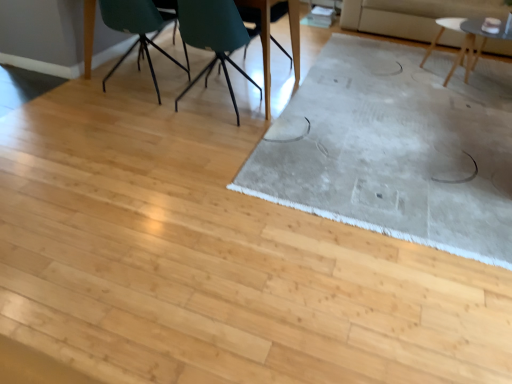
Question: Is teal plastic chair at upper center, which ranks as the 2th chair in left-to-right order, at the right side of matte wood table at upper center, marked as the 2th table in a right-to-left arrangement?

Choices:
 (A) no
 (B) yes

Answer: (B)

Question: From a real-world perspective, is teal plastic chair at upper center, the second chair in the right-to-left sequence, physically above matte wood table at upper center, acting as the first table starting from the left?

Choices:
 (A) no
 (B) yes

Answer: (B)

Question: Is teal plastic chair at upper center, the second chair in the right-to-left sequence, in contact with matte wood table at upper center, acting as the first table starting from the left?

Choices:
 (A) yes
 (B) no

Answer: (B)

Question: Can you confirm if teal plastic chair at upper center, the second chair in the right-to-left sequence, is shorter than matte wood table at upper center, marked as the 2th table in a right-to-left arrangement?

Choices:
 (A) no
 (B) yes

Answer: (B)

Question: Are teal plastic chair at upper center, which ranks as the 2th chair in left-to-right order, and matte wood table at upper center, marked as the 2th table in a right-to-left arrangement, located far from each other?

Choices:
 (A) no
 (B) yes

Answer: (A)

Question: From a real-world perspective, is matte wood table at upper center, acting as the first table starting from the left, physically located above or below beige fabric couch at upper right?

Choices:
 (A) below
 (B) above

Answer: (B)

Question: Would you say matte wood table at upper center, acting as the first table starting from the left, is to the left or to the right of beige fabric couch at upper right in the picture?

Choices:
 (A) left
 (B) right

Answer: (A)

Question: From the image's perspective, is matte wood table at upper center, acting as the first table starting from the left, positioned above or below beige fabric couch at upper right?

Choices:
 (A) above
 (B) below

Answer: (B)

Question: Would you say matte wood table at upper center, acting as the first table starting from the left, is inside or outside beige fabric couch at upper right?

Choices:
 (A) outside
 (B) inside

Answer: (A)

Question: Considering the relative positions of matte teal chair at upper left, positioned as the 3th chair in right-to-left order, and matte wood table at upper center, acting as the first table starting from the left, in the image provided, is matte teal chair at upper left, positioned as the 3th chair in right-to-left order, to the left or to the right of matte wood table at upper center, acting as the first table starting from the left,?

Choices:
 (A) right
 (B) left

Answer: (B)

Question: From the image's perspective, relative to matte wood table at upper center, acting as the first table starting from the left, is matte teal chair at upper left, positioned as the 3th chair in right-to-left order, above or below?

Choices:
 (A) below
 (B) above

Answer: (A)

Question: Based on their sizes in the image, would you say matte teal chair at upper left, positioned as the 3th chair in right-to-left order, is bigger or smaller than matte wood table at upper center, acting as the first table starting from the left?

Choices:
 (A) big
 (B) small

Answer: (B)

Question: In terms of height, does matte teal chair at upper left, which ranks as the first chair in left-to-right order, look taller or shorter compared to matte wood table at upper center, marked as the 2th table in a right-to-left arrangement?

Choices:
 (A) short
 (B) tall

Answer: (A)

Question: In terms of width, does beige fabric couch at upper right look wider or thinner when compared to light gray textured rug at center?

Choices:
 (A) wide
 (B) thin

Answer: (B)

Question: Choose the correct answer: Is beige fabric couch at upper right inside light gray textured rug at center or outside it?

Choices:
 (A) inside
 (B) outside

Answer: (B)